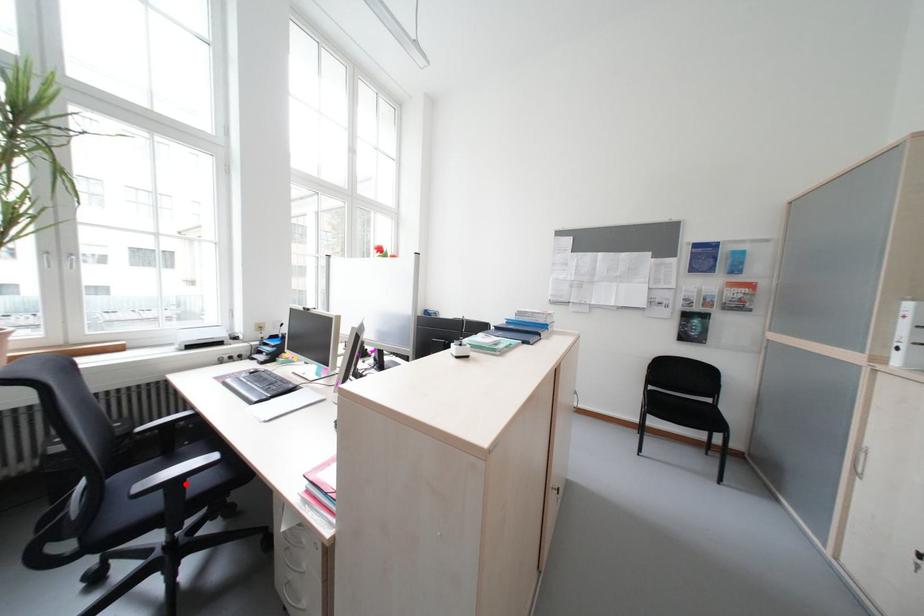
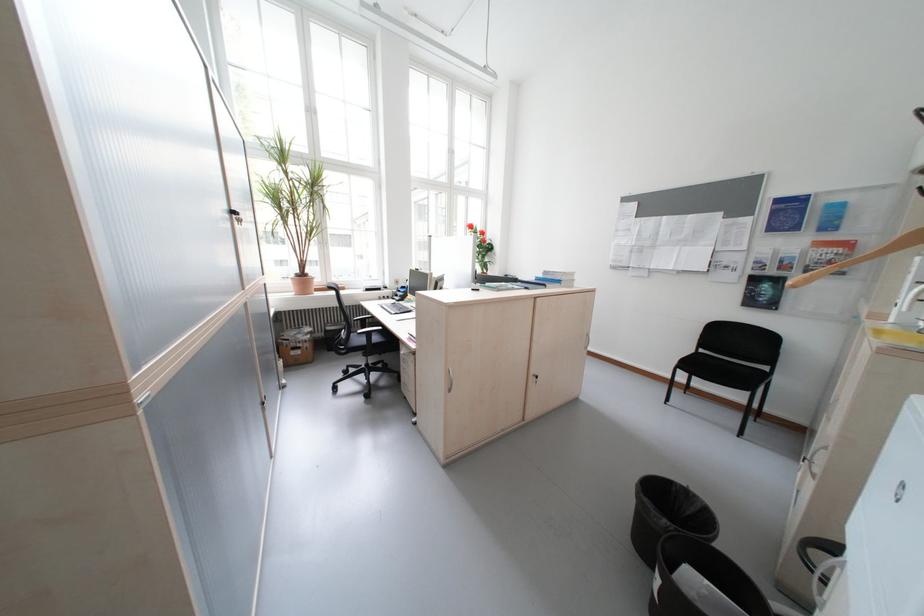
Locate, in the second image, the point that corresponds to the highlighted location in the first image.

(380, 334)